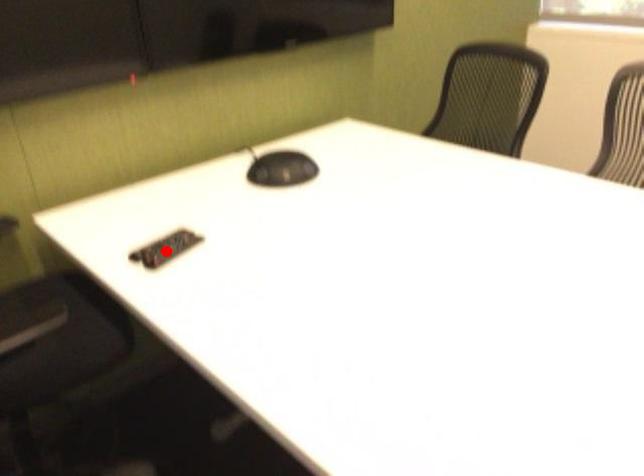
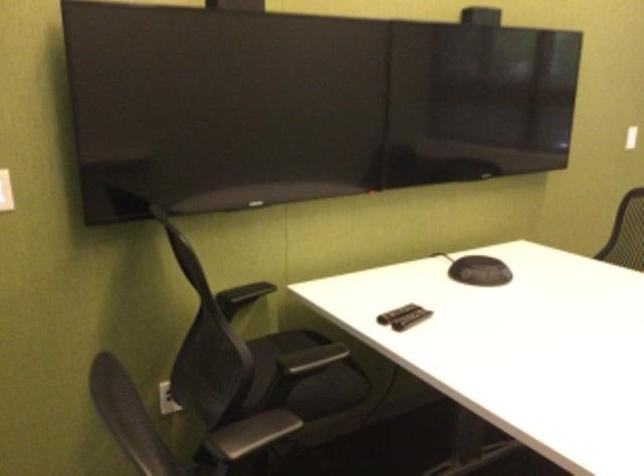
Question: I am providing you with two images of the same scene from different viewpoints. Image1 has a red point marked. In image2, the corresponding 3D location appears at what relative position? Reply with the corresponding letter.

Choices:
 (A) Closer
 (B) Farther

Answer: (B)